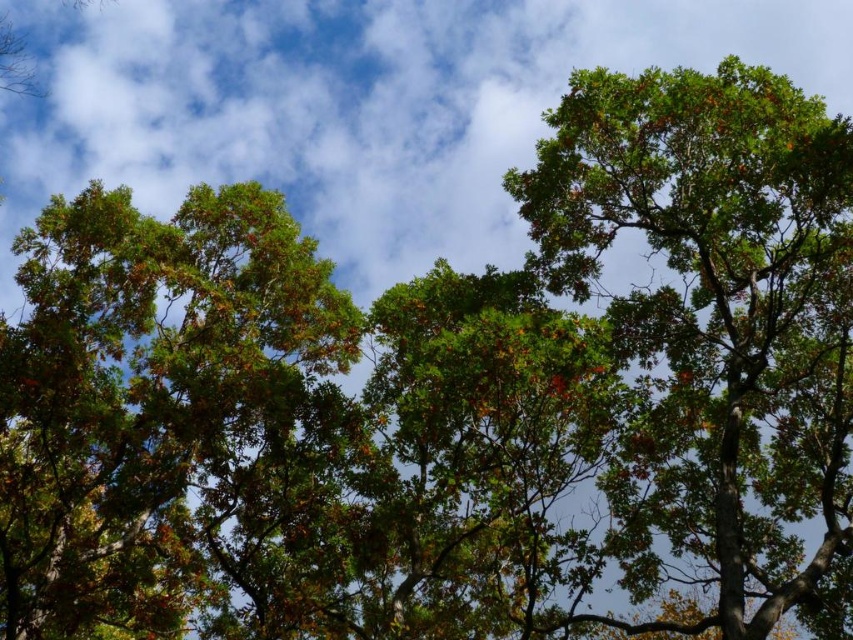
You are standing below the trees and looking up. Which tree, the green leafy tree at upper left or the green leafy tree at upper right, appears closer to you?

The green leafy tree at upper left appears closer to you because it is in front of the green leafy tree at upper right.

Based on the photo, you are a bird flying through the tree canopy. You notice two trees, the green leafy tree at upper left and the green leafy tree at upper right. Which tree would you need to fly higher to pass over?

The green leafy tree at upper right is taller than the green leafy tree at upper left, so you would need to fly higher to pass over the green leafy tree at upper right.

You are standing below the tree canopy and want to identify the smaller tree. Which one is it between the green leafy tree at upper left and the green leafy tree at upper right?

The green leafy tree at upper left is smaller in size compared to the green leafy tree at upper right.